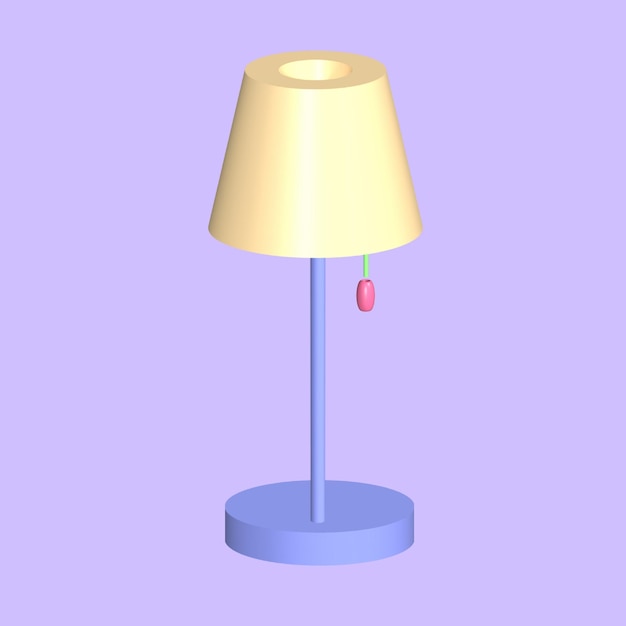
At what (x,y) coordinates should I click in order to perform the action: click on lamp switch. Please return your answer as a coordinate pair (x, y). The height and width of the screenshot is (626, 626). Looking at the image, I should click on (366, 305).